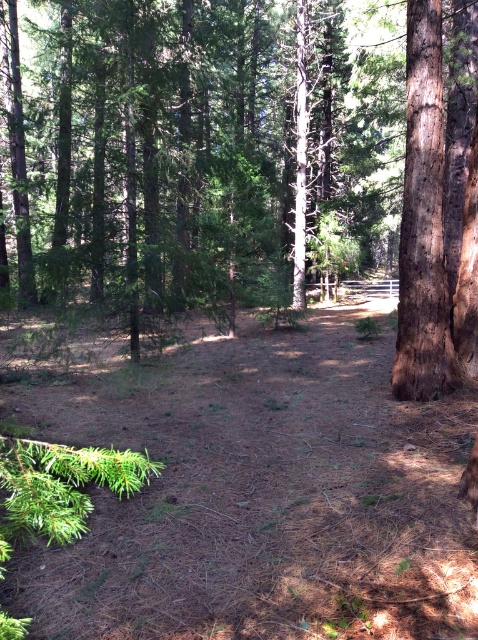
In the scene shown: Which is above, brown textured tree at center or brown rough bark tree at right?

Positioned higher is brown textured tree at center.

Which of these two, brown textured tree at center or brown rough bark tree at right, stands shorter?

brown rough bark tree at right

In order to click on brown textured tree at center in this screenshot , I will do `click(243, 164)`.

Find the location of a particular element. The height and width of the screenshot is (640, 478). brown textured tree at center is located at coordinates (243, 164).